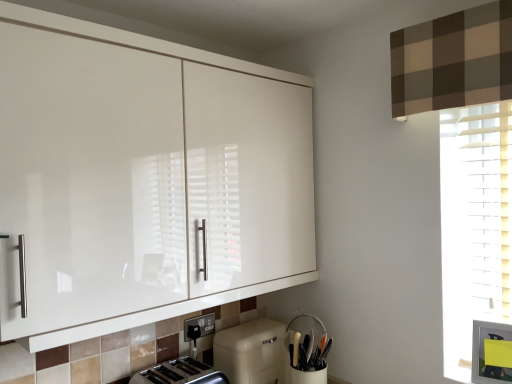
The image size is (512, 384). Identify the location of silver metallic toaster at lower center. pos(180,373).

What is the approximate width of beige matte dishwasher at lower center?

It is 8.96 inches.

I want to click on white glossy cabinet at upper left, so click(x=143, y=178).

Identify the location of black plastic electric outlet at lower center. This screenshot has height=384, width=512. (199, 327).

The height and width of the screenshot is (384, 512). What do you see at coordinates (199, 327) in the screenshot?
I see `black plastic electric outlet at lower center` at bounding box center [199, 327].

What are the coordinates of `silver metallic toaster at lower center` in the screenshot? It's located at (180, 373).

From the image's perspective, between beige matte dishwasher at lower center and white glossy cabinet at upper left, which one is located above?

white glossy cabinet at upper left appears higher in the image.

Can you see beige matte dishwasher at lower center touching white glossy cabinet at upper left?

No, beige matte dishwasher at lower center is not in contact with white glossy cabinet at upper left.

Is beige matte dishwasher at lower center to the right of white glossy cabinet at upper left from the viewer's perspective?

Correct, you'll find beige matte dishwasher at lower center to the right of white glossy cabinet at upper left.

Is white glossy cabinet at upper left inside beige matte dishwasher at lower center?

No.

Is point (188, 321) closer or farther from the camera than point (157, 47)?

Clearly, point (188, 321) is more distant from the camera than point (157, 47).

How different are the orientations of black plastic electric outlet at lower center and white glossy cabinet at upper left in degrees?

black plastic electric outlet at lower center and white glossy cabinet at upper left are facing 1.17 degrees away from each other.

Considering the sizes of objects black plastic electric outlet at lower center and white glossy cabinet at upper left in the image provided, who is smaller, black plastic electric outlet at lower center or white glossy cabinet at upper left?

With smaller size is black plastic electric outlet at lower center.

From the image's perspective, is black plastic electric outlet at lower center below white glossy cabinet at upper left?

Yes, from the image's perspective, black plastic electric outlet at lower center is below white glossy cabinet at upper left.

Can silver metallic toaster at lower center be found inside beige matte dishwasher at lower center?

No, silver metallic toaster at lower center is not inside beige matte dishwasher at lower center.

In the scene shown: Does beige matte dishwasher at lower center have a greater height compared to silver metallic toaster at lower center?

Yes.

Considering the relative positions of beige matte dishwasher at lower center and silver metallic toaster at lower center in the image provided, is beige matte dishwasher at lower center to the left or to the right of silver metallic toaster at lower center?

beige matte dishwasher at lower center is to the right of silver metallic toaster at lower center.

Is beige matte dishwasher at lower center not near silver metallic toaster at lower center?

No, there isn't a large distance between beige matte dishwasher at lower center and silver metallic toaster at lower center.

Considering the sizes of objects black plastic electric outlet at lower center and white matte utensil holder at lower center in the image provided, who is bigger, black plastic electric outlet at lower center or white matte utensil holder at lower center?

Bigger between the two is white matte utensil holder at lower center.

Based on the photo, is black plastic electric outlet at lower center facing towards white matte utensil holder at lower center?

No, black plastic electric outlet at lower center does not turn towards white matte utensil holder at lower center.

Is black plastic electric outlet at lower center inside or outside of white matte utensil holder at lower center?

black plastic electric outlet at lower center exists outside the volume of white matte utensil holder at lower center.

Based on the photo, between black plastic electric outlet at lower center and white matte utensil holder at lower center, which one is positioned in front?

white matte utensil holder at lower center is more forward.

Consider the image. Can you tell me how much silver metallic toaster at lower center and white glossy cabinet at upper left differ in facing direction?

1.23 degrees separate the facing orientations of silver metallic toaster at lower center and white glossy cabinet at upper left.

The image size is (512, 384). I want to click on cabinetry that appears above the silver metallic toaster at lower center (from the image's perspective), so click(143, 178).

Could you tell me if silver metallic toaster at lower center is facing white glossy cabinet at upper left?

No.

Looking at this image, from the image's perspective, is silver metallic toaster at lower center on white glossy cabinet at upper left?

No, from the image's perspective, silver metallic toaster at lower center is not over white glossy cabinet at upper left.

Could you tell me if silver metallic toaster at lower center is facing black plastic electric outlet at lower center?

No, silver metallic toaster at lower center is not facing towards black plastic electric outlet at lower center.

Is silver metallic toaster at lower center in front of or behind black plastic electric outlet at lower center in the image?

silver metallic toaster at lower center is in front of black plastic electric outlet at lower center.

Based on the photo, can you confirm if silver metallic toaster at lower center is wider than black plastic electric outlet at lower center?

Correct, the width of silver metallic toaster at lower center exceeds that of black plastic electric outlet at lower center.

The image size is (512, 384). In order to click on dish washer that appears in front of the black plastic electric outlet at lower center in this screenshot , I will do `click(251, 352)`.

Between beige matte dishwasher at lower center and black plastic electric outlet at lower center, which one has more height?

With more height is beige matte dishwasher at lower center.

Could black plastic electric outlet at lower center be considered to be inside beige matte dishwasher at lower center?

No, black plastic electric outlet at lower center is not a part of beige matte dishwasher at lower center.

Is beige matte dishwasher at lower center beside black plastic electric outlet at lower center?

beige matte dishwasher at lower center and black plastic electric outlet at lower center are clearly separated.

Locate an element on the screen. The width and height of the screenshot is (512, 384). dish washer behind the white glossy cabinet at upper left is located at coordinates (251, 352).

Where is `cabinetry located above the black plastic electric outlet at lower center (from a real-world perspective)`? This screenshot has width=512, height=384. cabinetry located above the black plastic electric outlet at lower center (from a real-world perspective) is located at coordinates pyautogui.click(x=143, y=178).

Estimate the real-world distances between objects in this image. Which object is further from beige matte dishwasher at lower center, white matte utensil holder at lower center or white glossy cabinet at upper left?

Among the two, white glossy cabinet at upper left is located further to beige matte dishwasher at lower center.

Which object lies further to the anchor point silver metallic toaster at lower center, white matte utensil holder at lower center or beige matte dishwasher at lower center?

The object further to silver metallic toaster at lower center is white matte utensil holder at lower center.

Which object lies further to the anchor point silver metallic toaster at lower center, beige matte dishwasher at lower center or white matte utensil holder at lower center?

white matte utensil holder at lower center is further to silver metallic toaster at lower center.

Based on the photo, based on their spatial positions, is black plastic electric outlet at lower center or beige matte dishwasher at lower center further from white glossy cabinet at upper left?

black plastic electric outlet at lower center lies further to white glossy cabinet at upper left than the other object.

Looking at the image, which one is located closer to silver metallic toaster at lower center, white glossy cabinet at upper left or white matte utensil holder at lower center?

Based on the image, white matte utensil holder at lower center appears to be nearer to silver metallic toaster at lower center.

From the image, which object appears to be nearer to black plastic electric outlet at lower center, white matte utensil holder at lower center or silver metallic toaster at lower center?

Among the two, silver metallic toaster at lower center is located nearer to black plastic electric outlet at lower center.

From the image, which object appears to be farther from beige matte dishwasher at lower center, silver metallic toaster at lower center or white glossy cabinet at upper left?

white glossy cabinet at upper left lies further to beige matte dishwasher at lower center than the other object.

From the picture: Looking at the image, which one is located further to white glossy cabinet at upper left, silver metallic toaster at lower center or black plastic electric outlet at lower center?

black plastic electric outlet at lower center lies further to white glossy cabinet at upper left than the other object.

Identify the location of electric outlet that lies between white glossy cabinet at upper left and beige matte dishwasher at lower center from top to bottom. (199, 327).

Where is `electric outlet between white glossy cabinet at upper left and silver metallic toaster at lower center in the up-down direction`? electric outlet between white glossy cabinet at upper left and silver metallic toaster at lower center in the up-down direction is located at coordinates (199, 327).

Where is `electric outlet between white glossy cabinet at upper left and white matte utensil holder at lower center in the up-down direction`? The width and height of the screenshot is (512, 384). electric outlet between white glossy cabinet at upper left and white matte utensil holder at lower center in the up-down direction is located at coordinates (199, 327).

Identify the location of toaster between white glossy cabinet at upper left and beige matte dishwasher at lower center vertically. (180, 373).